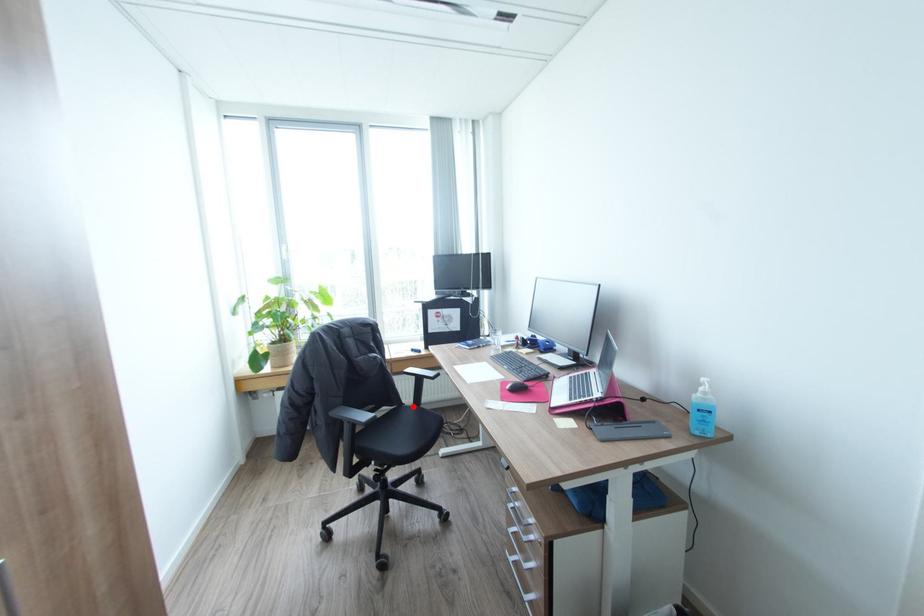
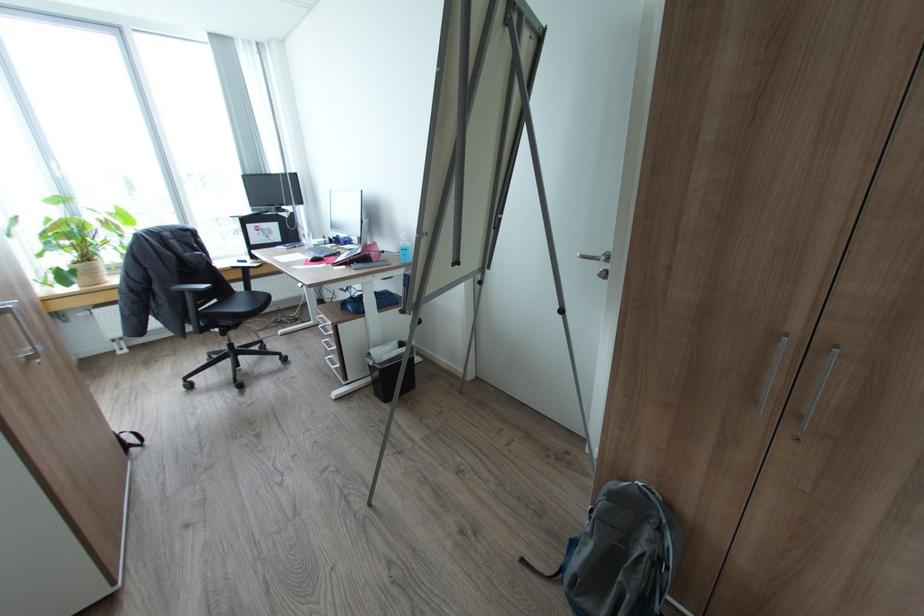
Question: A red point is marked in image1. In image2, is the corresponding 3D point closer to the camera or farther? Reply with the corresponding letter.

Choices:
 (A) The corresponding 3D point is closer.
 (B) The corresponding 3D point is farther.

Answer: (A)